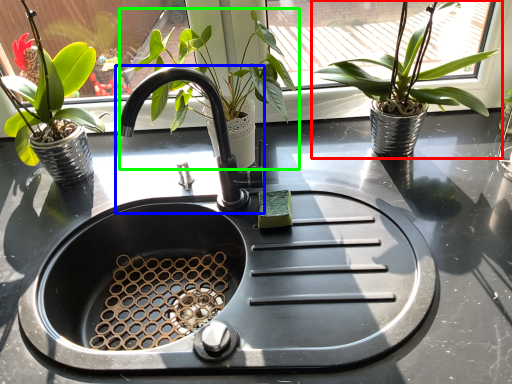
Question: Which object is the closest to the houseplant (highlighted by a red box)? Choose among these: tap (highlighted by a blue box) or houseplant (highlighted by a green box).

Choices:
 (A) tap
 (B) houseplant

Answer: (B)